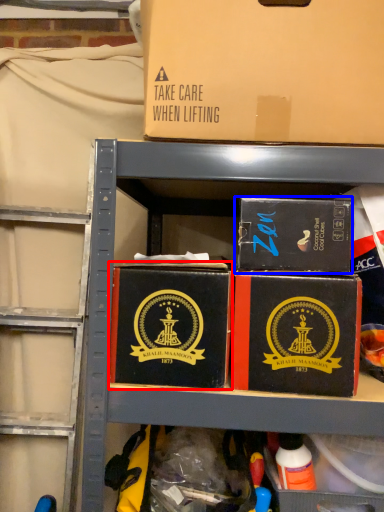
Question: Among these objects, which one is farthest to the camera, box (highlighted by a red box) or box (highlighted by a blue box)?

Choices:
 (A) box
 (B) box

Answer: (B)